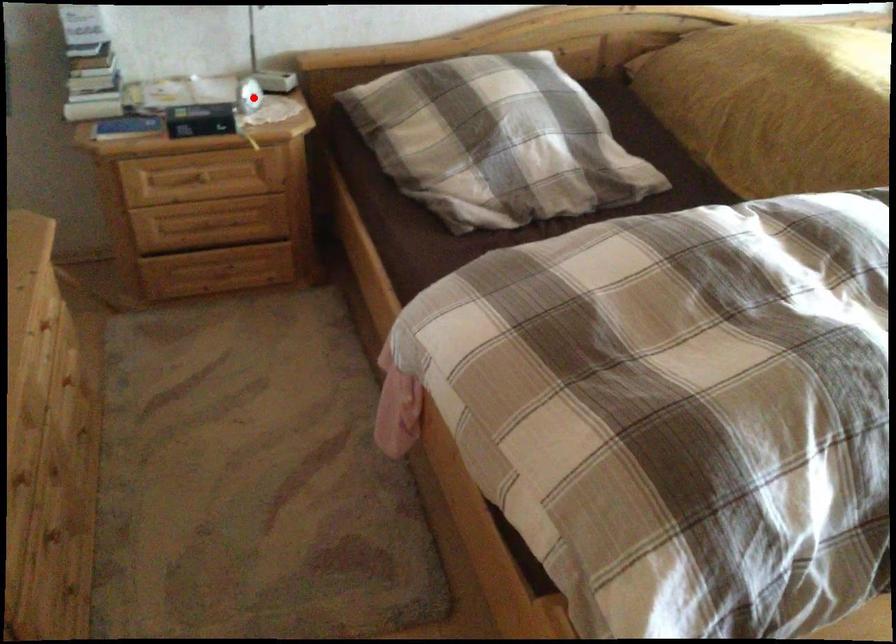
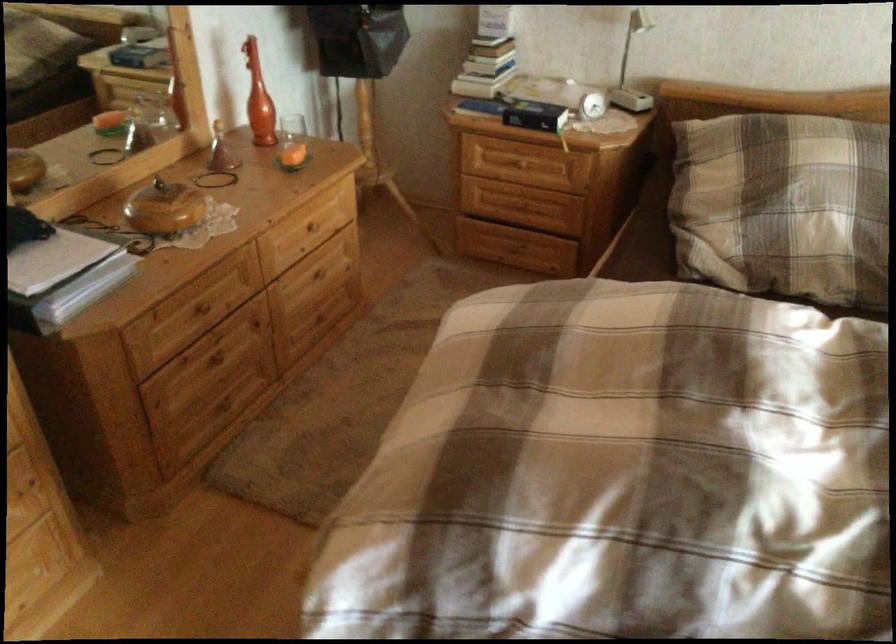
The point at the highlighted location is marked in the first image. Where is the corresponding point in the second image?

(587, 100)